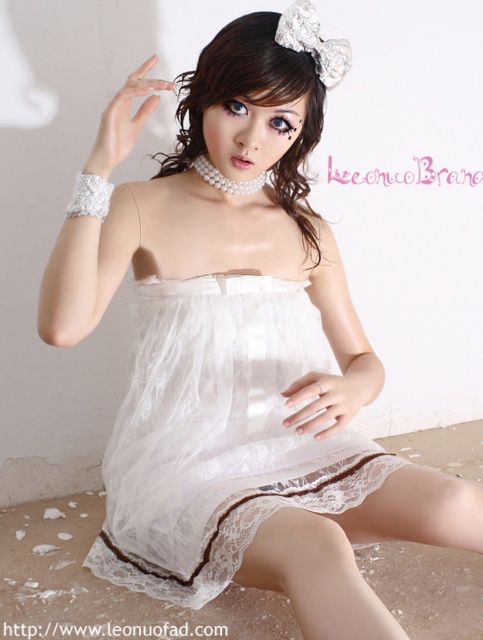
Question: Does white matte nails at center appear under pearl/glossy bracelet at upper left?

Choices:
 (A) yes
 (B) no

Answer: (A)

Question: Which point appears closest to the camera in this image?

Choices:
 (A) (172, 289)
 (B) (241, 29)

Answer: (B)

Question: Which point is farther from the camera taking this photo?

Choices:
 (A) (126, 100)
 (B) (194, 557)
 (C) (318, 433)
 (D) (181, 156)

Answer: (D)

Question: Does white matte nails at center have a lesser width compared to pearl/glossy bracelet at upper left?

Choices:
 (A) no
 (B) yes

Answer: (A)

Question: Does white lace dress at center appear on the left side of pearl/glossy bracelet at upper left?

Choices:
 (A) no
 (B) yes

Answer: (A)

Question: Which of these objects is positioned closest to the brown shiny hair at upper center?

Choices:
 (A) pearl/glossy bracelet at upper left
 (B) white lace dress at center
 (C) white matte nails at center

Answer: (A)